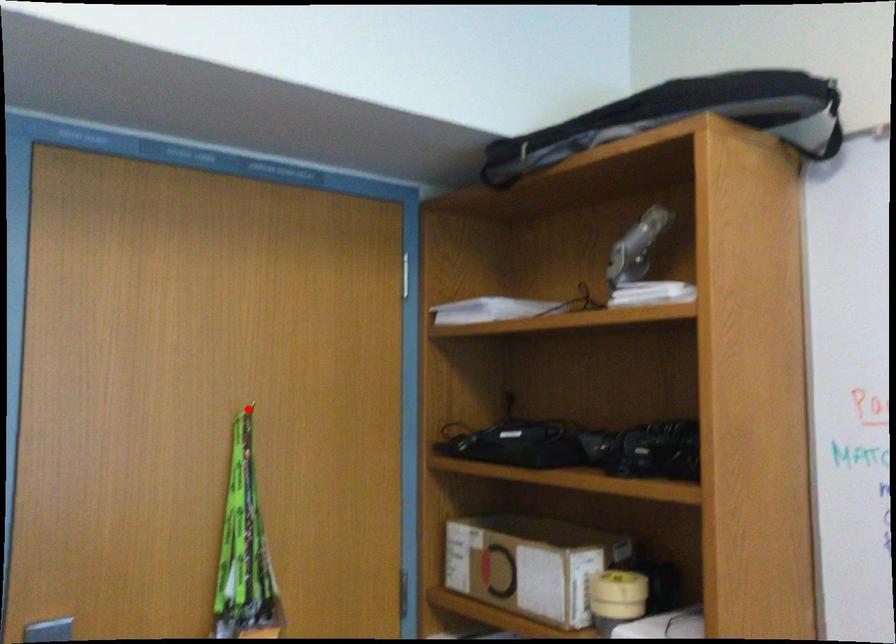
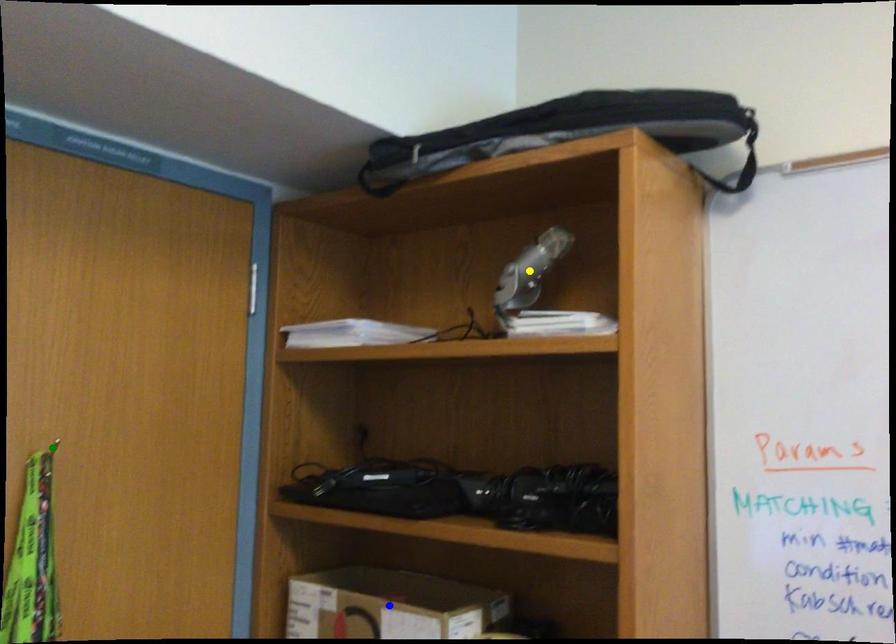
Question: I am providing you with two images of the same scene from different viewpoints. A red point is marked on the first image. You are given multiple points on the second image. Which point in image 2 represents the same 3d spot as the red point in image 1?

Choices:
 (A) green point
 (B) blue point
 (C) yellow point

Answer: (A)